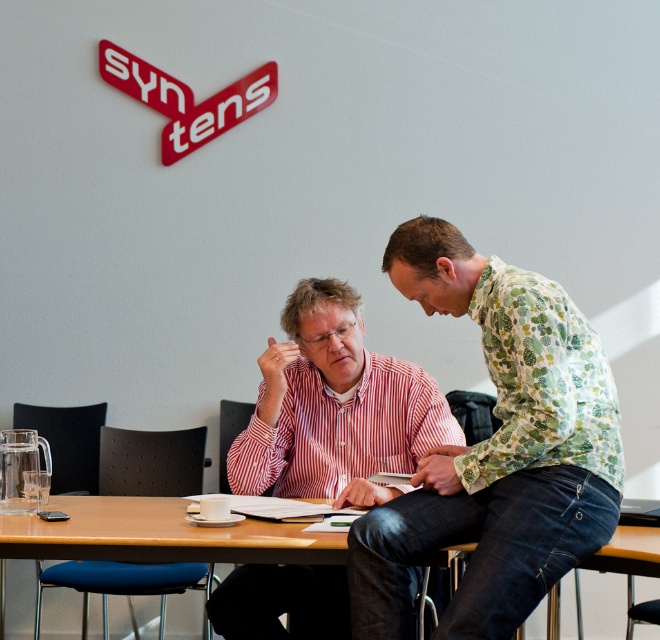
Where is the striped cotton shirt at center located in the image?

The striped cotton shirt at center is located at point coordinates of [335,406].